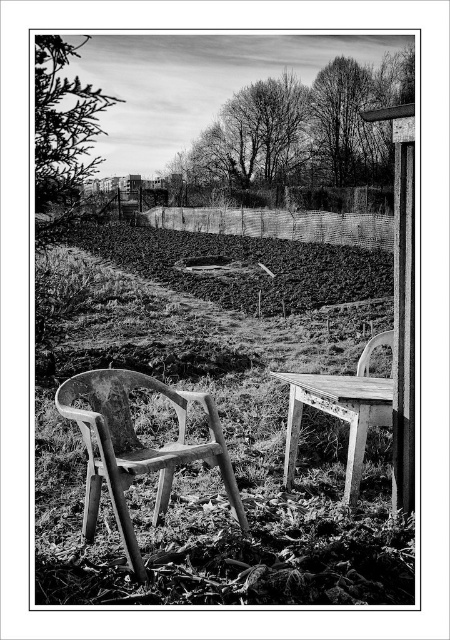
Does green grass at center appear over bare branches at upper center?

No, green grass at center is not above bare branches at upper center.

Does green grass at center appear on the right side of bare branches at upper center?

Correct, you'll find green grass at center to the right of bare branches at upper center.

What are the coordinates of `green grass at center` in the screenshot? It's located at (220, 419).

Can you confirm if green grass at center is positioned to the right of green leafy tree at upper left?

Yes, green grass at center is to the right of green leafy tree at upper left.

Is green grass at center taller than green leafy tree at upper left?

No, green grass at center is not taller than green leafy tree at upper left.

Is point (153, 408) farther from viewer compared to point (72, 141)?

Yes, point (153, 408) is behind point (72, 141).

At what (x,y) coordinates should I click in order to perform the action: click on green grass at center. Please return your answer as a coordinate pair (x, y). The image size is (450, 640). Looking at the image, I should click on click(x=220, y=419).

What do you see at coordinates (300, 140) in the screenshot? I see `bare branches at upper center` at bounding box center [300, 140].

Is point (265, 83) less distant than point (85, 417)?

No, it is behind (85, 417).

The image size is (450, 640). Identify the location of bare branches at upper center. (300, 140).